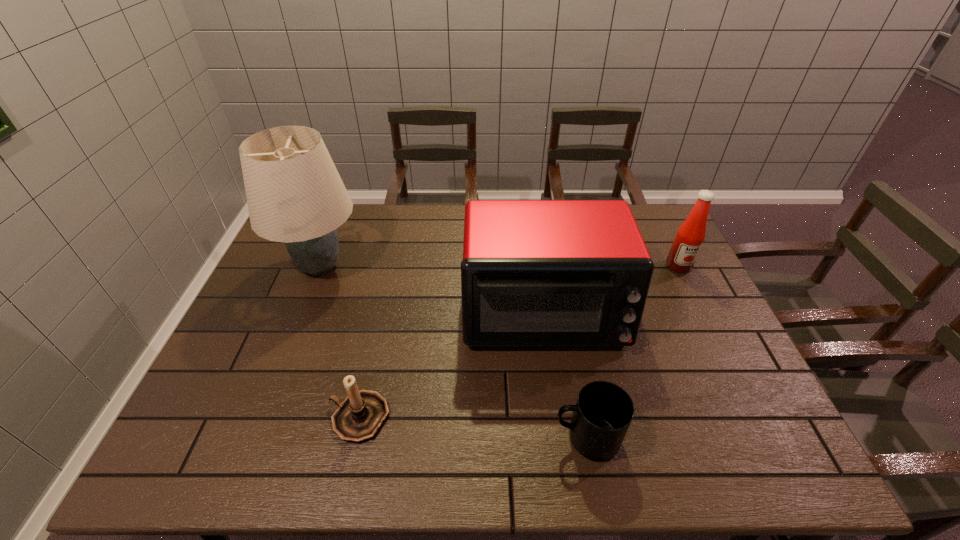
Find the location of a particular element. The width and height of the screenshot is (960, 540). the tallest object is located at coordinates 295,195.

Find the location of `the leftmost object`. the leftmost object is located at coordinates [295, 195].

The width and height of the screenshot is (960, 540). I want to click on toaster oven, so click(534, 272).

Find the location of `the rightmost object`. the rightmost object is located at coordinates (690, 236).

Where is `candle holder`? The image size is (960, 540). candle holder is located at coordinates (359, 417).

In order to click on the shortest object in this screenshot , I will do `click(602, 415)`.

The height and width of the screenshot is (540, 960). Find the location of `free space located 0.070m on the front of the tallest object`. free space located 0.070m on the front of the tallest object is located at coordinates (300, 316).

Find the location of a particular element. This screenshot has height=540, width=960. vacant region located on the front-facing side of the toaster oven is located at coordinates (559, 421).

This screenshot has height=540, width=960. I want to click on vacant region located 0.120m on the front-facing side of the rightmost object, so click(x=696, y=302).

Locate an element on the screen. The height and width of the screenshot is (540, 960). vacant region located on the back of the candle holder is located at coordinates (371, 362).